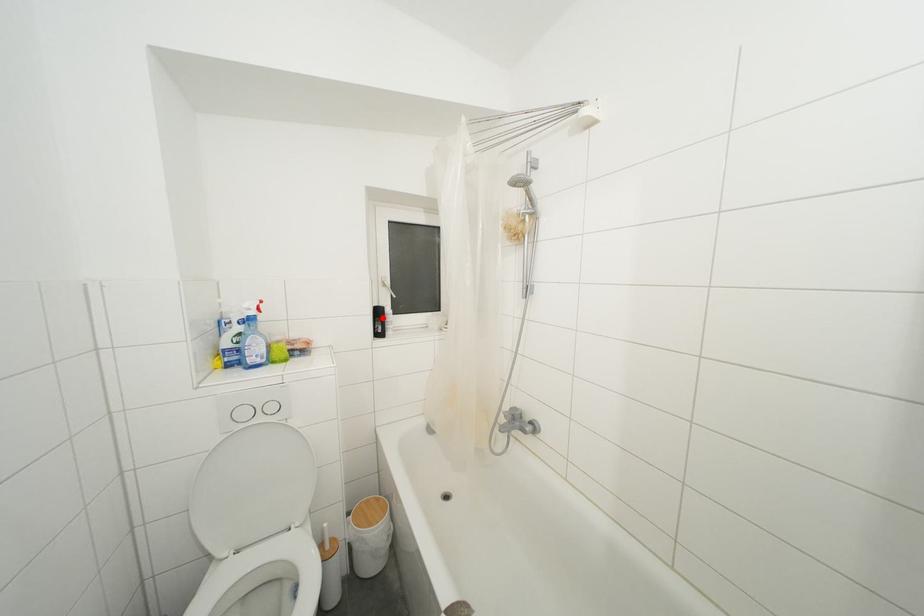
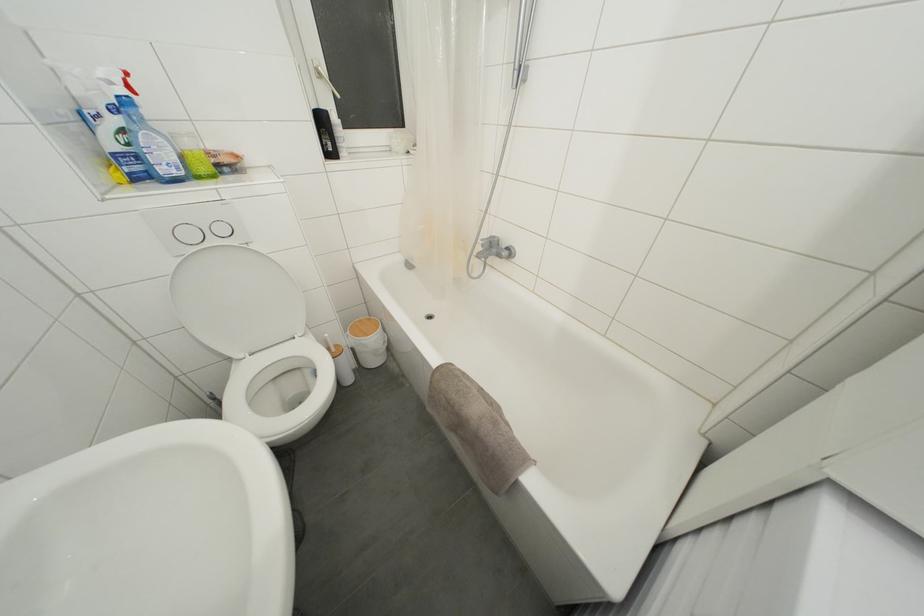
The point at the highlighted location is marked in the first image. Where is the corresponding point in the second image?

(325, 126)